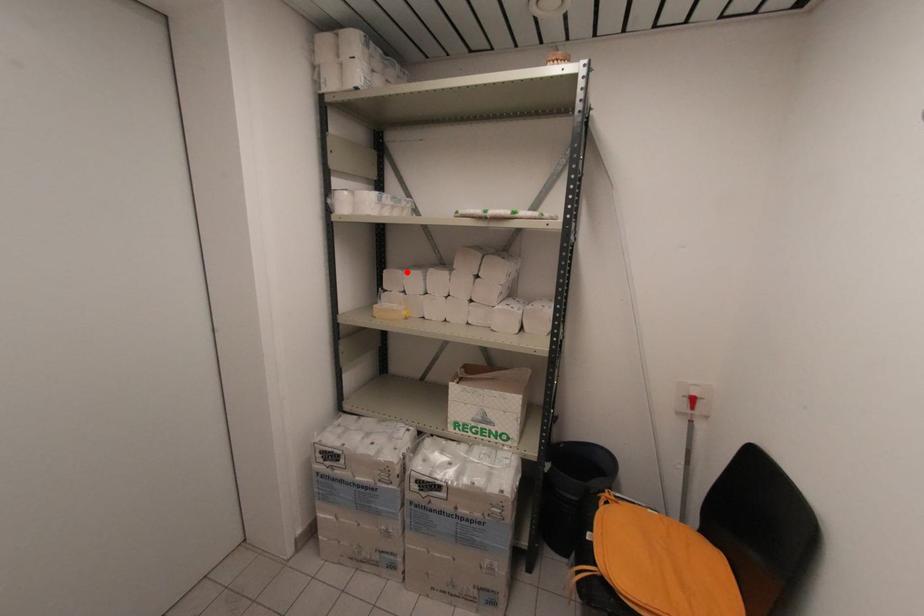
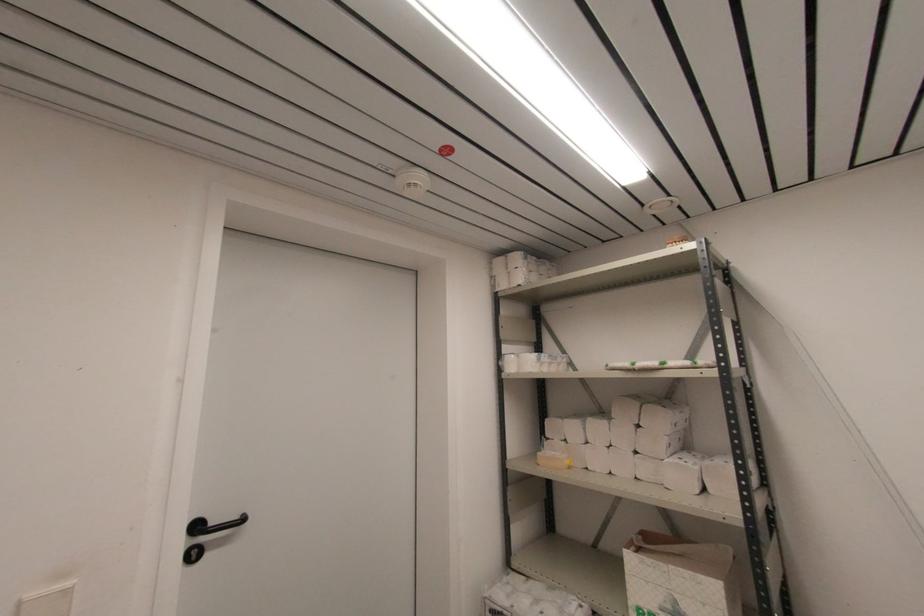
Locate, in the second image, the point that corresponds to the highlighted location in the first image.

(566, 421)